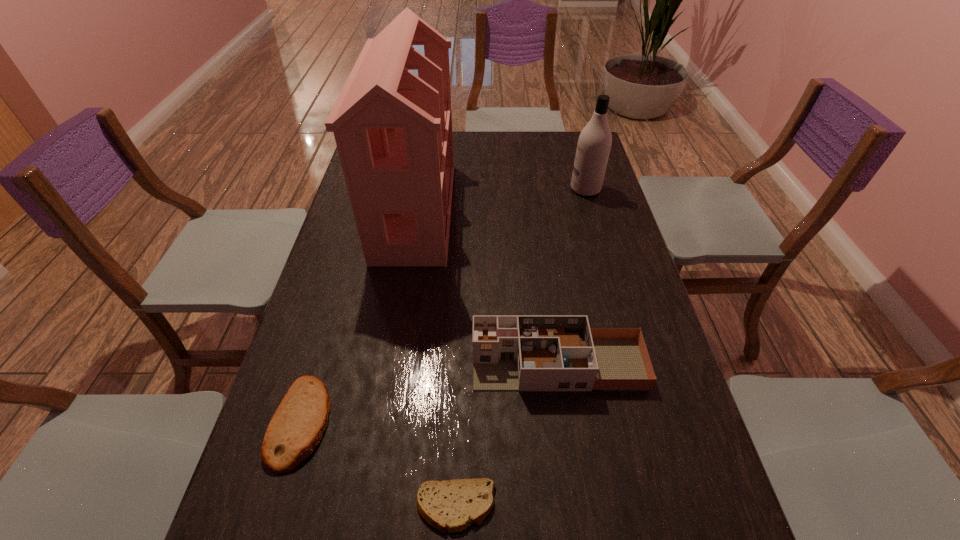
In order to click on blank region between the nearer pita bread and the farther dollhouse in this screenshot , I will do `click(436, 359)`.

This screenshot has width=960, height=540. Find the location of `empty space between the farther pita bread and the shortest object`. empty space between the farther pita bread and the shortest object is located at coordinates (378, 464).

Locate an element on the screen. This screenshot has height=540, width=960. free space between the shorter pita bread and the farther pita bread is located at coordinates (378, 464).

Locate which object ranks second in proximity to the fourth shortest object. Please provide its 2D coordinates. Your answer should be formatted as a tuple, i.e. [(x, y)], where the tuple contains the x and y coordinates of a point satisfying the conditions above.

[(510, 352)]

Select which object appears as the third closest to the left pita bread. Please provide its 2D coordinates. Your answer should be formatted as a tuple, i.e. [(x, y)], where the tuple contains the x and y coordinates of a point satisfying the conditions above.

[(393, 130)]

Locate an element on the screen. free point that satisfies the following two spatial constraints: 1. on the front-facing side of the taller dollhouse; 2. on the front side of the left pita bread is located at coordinates (380, 422).

Locate an element on the screen. vacant point that satisfies the following two spatial constraints: 1. on the front-facing side of the nearest object; 2. on the left side of the taller dollhouse is located at coordinates (367, 507).

You are a GUI agent. You are given a task and a screenshot of the screen. Output one action in this format:
    pyautogui.click(x=<x>, y=<y>)
    Task: Click on the vacant space that satisfies the following two spatial constraints: 1. at the entrance of the right dollhouse; 2. on the front side of the nearer pita bread
    This screenshot has width=960, height=540.
    Given the screenshot: What is the action you would take?
    pyautogui.click(x=579, y=507)